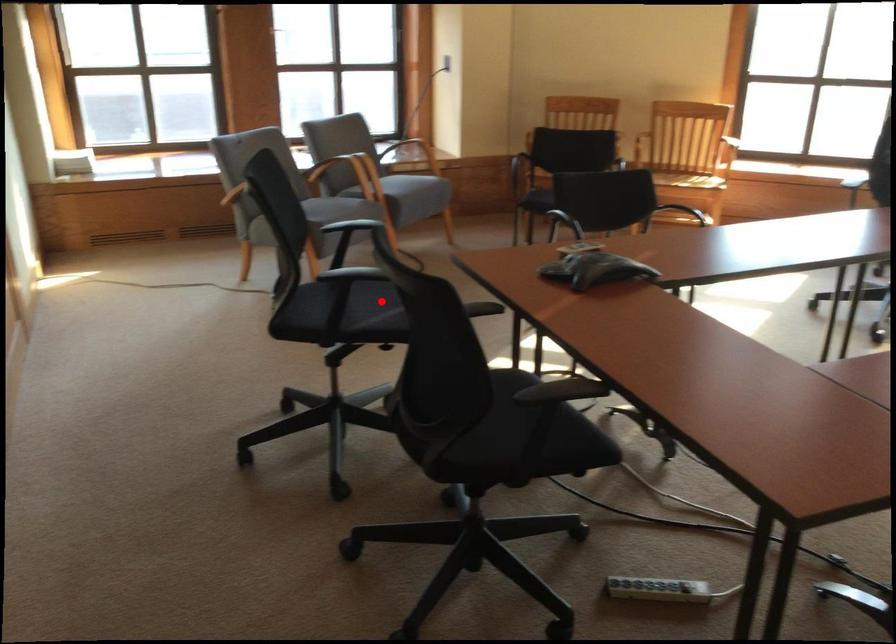
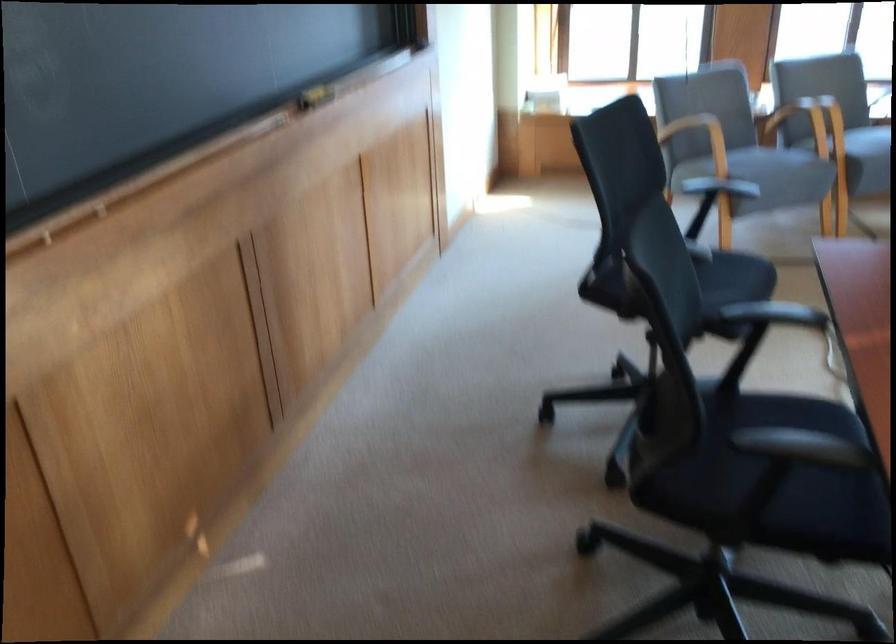
Locate, in the second image, the point that corresponds to the highlighted location in the first image.

(717, 285)